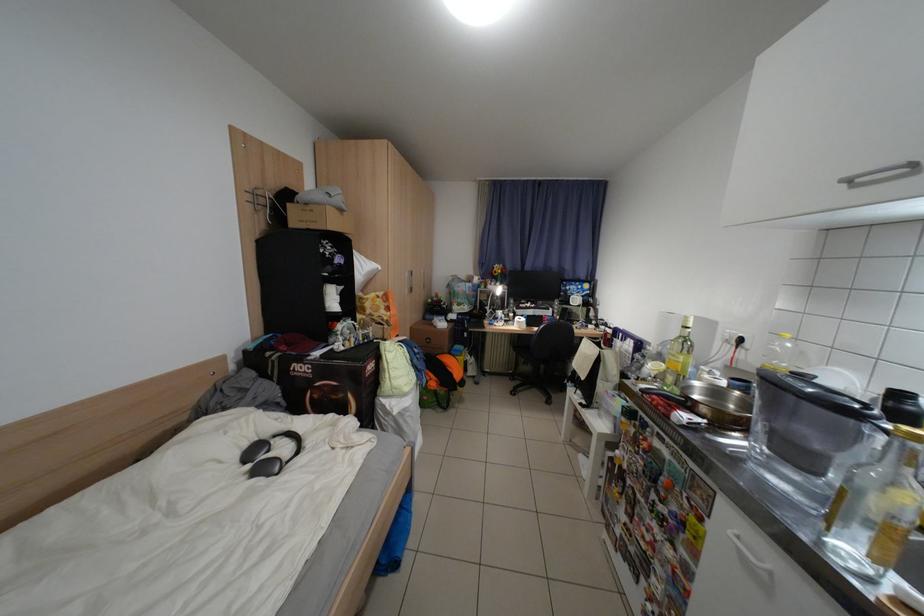
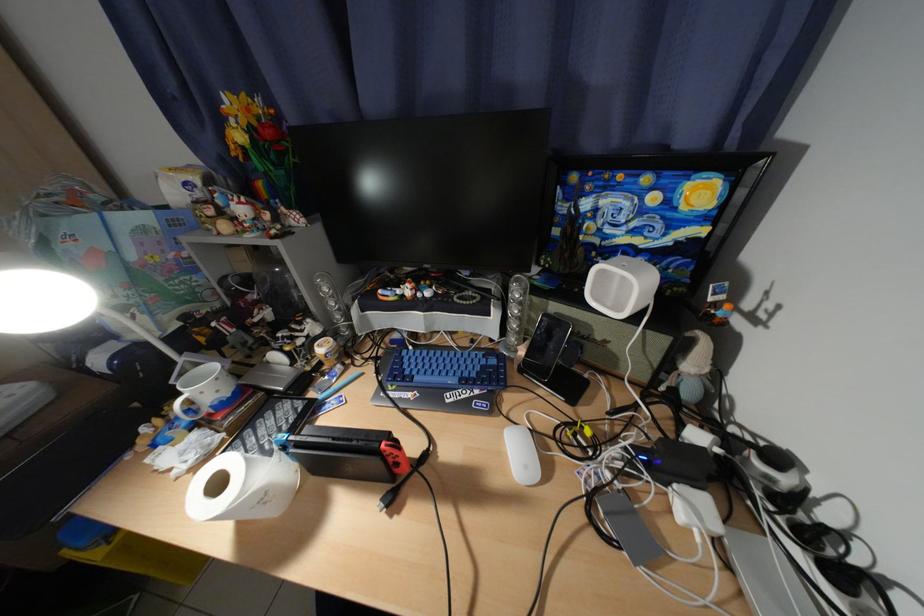
Locate, in the second image, the point that corresponds to (x=602, y=315) in the first image.

(704, 367)